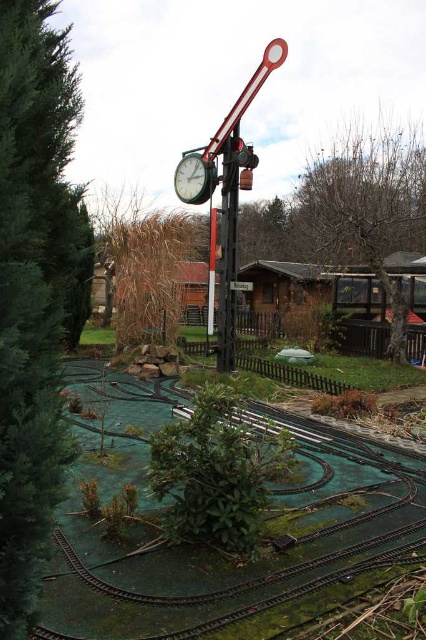
Does bare branches at right have a lesser height compared to metallic clock at center?

No.

Which is more to the right, bare branches at right or metallic clock at center?

bare branches at right

Who is more distant from viewer, (397, 356) or (176, 186)?

Positioned behind is point (397, 356).

Find the location of a particular element. The width and height of the screenshot is (426, 640). bare branches at right is located at coordinates (368, 208).

Between green rubber train track at lower center and metallic pole at center, which one is positioned higher?

metallic pole at center is higher up.

Is point (422, 522) positioned in front of point (229, 141)?

Yes.

Find the location of a particular element. This screenshot has width=426, height=640. green rubber train track at lower center is located at coordinates (235, 557).

Is point (396, 244) more distant than point (169, 257)?

That is True.

Can you confirm if bare branches at right is bigger than brown grass at center?

Yes, bare branches at right is bigger than brown grass at center.

Does point (402, 211) come in front of point (120, 280)?

No, it is behind (120, 280).

This screenshot has height=640, width=426. What are the coordinates of `bare branches at right` in the screenshot? It's located at point(368,208).